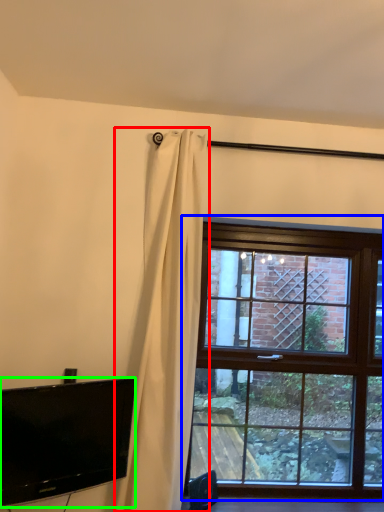
Question: Which object is positioned farthest from curtain (highlighted by a red box)? Select from window (highlighted by a blue box) and television (highlighted by a green box).

Choices:
 (A) window
 (B) television

Answer: (A)